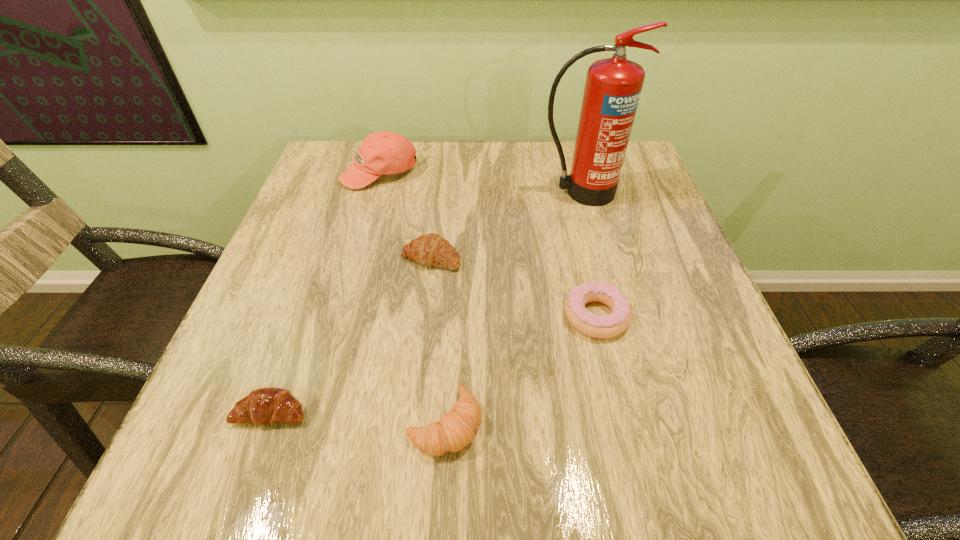
The height and width of the screenshot is (540, 960). I want to click on vacant space at the far edge of the desktop, so click(511, 164).

Locate an element on the screen. vacant point at the left edge is located at coordinates (319, 330).

Where is `free space at the right edge of the desktop`? free space at the right edge of the desktop is located at coordinates (651, 299).

You are a GUI agent. You are given a task and a screenshot of the screen. Output one action in this format:
    pyautogui.click(x=<x>, y=<y>)
    Task: Click on the free space at the far left corner
    This screenshot has width=960, height=540.
    Given the screenshot: What is the action you would take?
    pyautogui.click(x=359, y=143)

Find the location of a particular element. This screenshot has width=960, height=540. vacant region at the near right corner of the desktop is located at coordinates (706, 434).

I want to click on blank region between the shortest crescent roll and the fifth shortest object, so click(325, 292).

Identify the location of vacant space that is in between the doughnut and the shortest object. This screenshot has width=960, height=540. (434, 363).

Where is `vacant space in between the tallest object and the fifth shortest object`? This screenshot has width=960, height=540. vacant space in between the tallest object and the fifth shortest object is located at coordinates (480, 183).

The height and width of the screenshot is (540, 960). I want to click on unoccupied position between the fire extinguisher and the farthest crescent roll, so click(x=506, y=225).

The image size is (960, 540). Find the location of `vacant region between the fire extinguisher and the fourth farthest object`. vacant region between the fire extinguisher and the fourth farthest object is located at coordinates (588, 254).